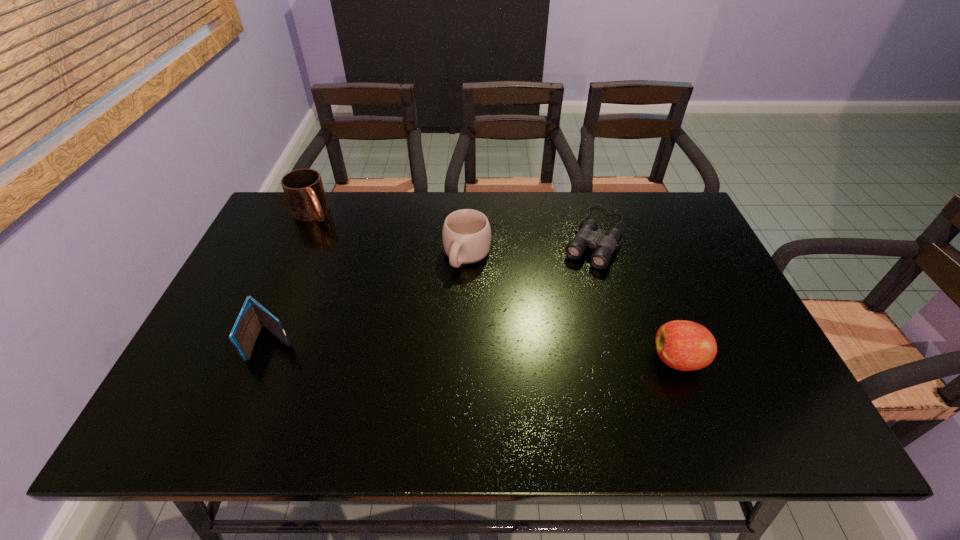
Locate an element on the screen. The width and height of the screenshot is (960, 540). wallet is located at coordinates (253, 315).

What are the coordinates of `apple` in the screenshot? It's located at (683, 345).

Where is `the left mug`? The image size is (960, 540). the left mug is located at coordinates (303, 188).

The height and width of the screenshot is (540, 960). I want to click on the third object from right to left, so click(x=466, y=234).

Image resolution: width=960 pixels, height=540 pixels. I want to click on the right mug, so (466, 234).

Where is `binoculars`? binoculars is located at coordinates (588, 236).

What are the coordinates of `free location located on the exterior surface of the wallet` in the screenshot? It's located at (255, 386).

Find the location of a particular element. The height and width of the screenshot is (540, 960). vacant area situated 0.210m on the back of the apple is located at coordinates (647, 278).

Where is `vacant space situated 0.310m on the side of the farther mug with the handle`? The height and width of the screenshot is (540, 960). vacant space situated 0.310m on the side of the farther mug with the handle is located at coordinates (364, 284).

Locate an element on the screen. Image resolution: width=960 pixels, height=540 pixels. vacant space located 0.090m on the side of the farther mug with the handle is located at coordinates (330, 241).